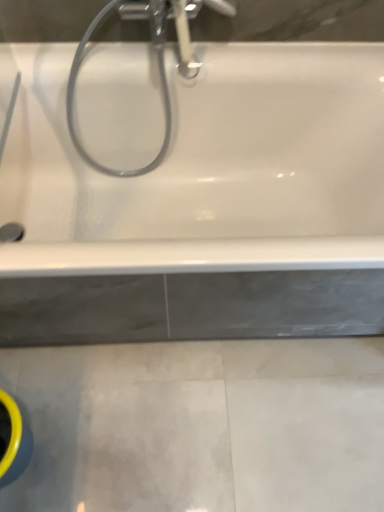
Question: From the image's perspective, does chrome metallic showerhead at upper center appear lower than satin nickel faucet at upper center?

Choices:
 (A) yes
 (B) no

Answer: (A)

Question: Would you say satin nickel faucet at upper center is part of chrome metallic showerhead at upper center's contents?

Choices:
 (A) no
 (B) yes

Answer: (B)

Question: Is satin nickel faucet at upper center at the back of chrome metallic showerhead at upper center?

Choices:
 (A) no
 (B) yes

Answer: (B)

Question: Can you confirm if chrome metallic showerhead at upper center is shorter than satin nickel faucet at upper center?

Choices:
 (A) yes
 (B) no

Answer: (B)

Question: Does chrome metallic showerhead at upper center have a greater height compared to satin nickel faucet at upper center?

Choices:
 (A) no
 (B) yes

Answer: (B)

Question: Is chrome metallic showerhead at upper center oriented towards satin nickel faucet at upper center?

Choices:
 (A) yes
 (B) no

Answer: (A)

Question: Is chrome metallic showerhead at upper center to the right of white glossy bathtub at upper center from the viewer's perspective?

Choices:
 (A) yes
 (B) no

Answer: (B)

Question: From the image's perspective, is chrome metallic showerhead at upper center located above white glossy bathtub at upper center?

Choices:
 (A) no
 (B) yes

Answer: (B)

Question: Considering the relative sizes of chrome metallic showerhead at upper center and white glossy bathtub at upper center in the image provided, is chrome metallic showerhead at upper center bigger than white glossy bathtub at upper center?

Choices:
 (A) yes
 (B) no

Answer: (B)

Question: Is chrome metallic showerhead at upper center next to white glossy bathtub at upper center and touching it?

Choices:
 (A) no
 (B) yes

Answer: (A)

Question: Can you confirm if chrome metallic showerhead at upper center is positioned to the left of white glossy bathtub at upper center?

Choices:
 (A) no
 (B) yes

Answer: (B)

Question: Could you tell me if chrome metallic showerhead at upper center is turned towards white glossy bathtub at upper center?

Choices:
 (A) no
 (B) yes

Answer: (B)

Question: Can you confirm if white glossy bathtub at upper center is shorter than satin nickel faucet at upper center?

Choices:
 (A) yes
 (B) no

Answer: (B)